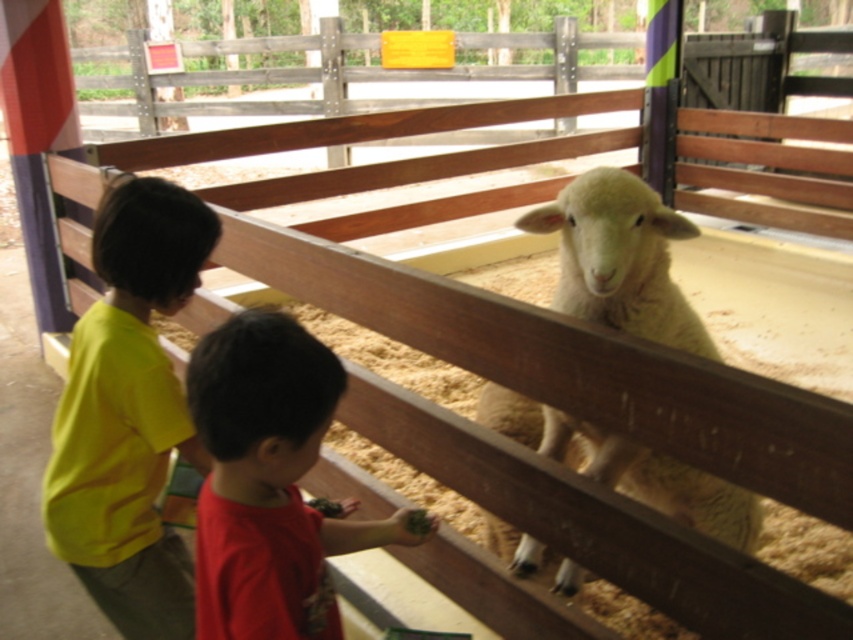
Is red cotton shirt at lower center bigger than white woolen sheep at center?

Incorrect, red cotton shirt at lower center is not larger than white woolen sheep at center.

Is red cotton shirt at lower center closer to the viewer compared to white woolen sheep at center?

That is True.

Which is in front, point (323, 404) or point (508, 532)?

Point (323, 404)

Locate an element on the screen. red cotton shirt at lower center is located at coordinates (270, 483).

Looking at this image, does yellow matte shirt at left appear on the right side of white woolen sheep at center?

In fact, yellow matte shirt at left is to the left of white woolen sheep at center.

Does yellow matte shirt at left appear under white woolen sheep at center?

Actually, yellow matte shirt at left is above white woolen sheep at center.

Is point (78, 426) positioned before point (625, 321)?

Yes, point (78, 426) is in front of point (625, 321).

Find the location of a particular element. This screenshot has height=640, width=853. yellow matte shirt at left is located at coordinates (129, 412).

Consider the image. Is yellow matte shirt at left behind red cotton shirt at lower center?

That is True.

Does yellow matte shirt at left have a lesser width compared to red cotton shirt at lower center?

Indeed, yellow matte shirt at left has a lesser width compared to red cotton shirt at lower center.

I want to click on yellow matte shirt at left, so click(x=129, y=412).

Identify the location of yellow matte shirt at left. (129, 412).